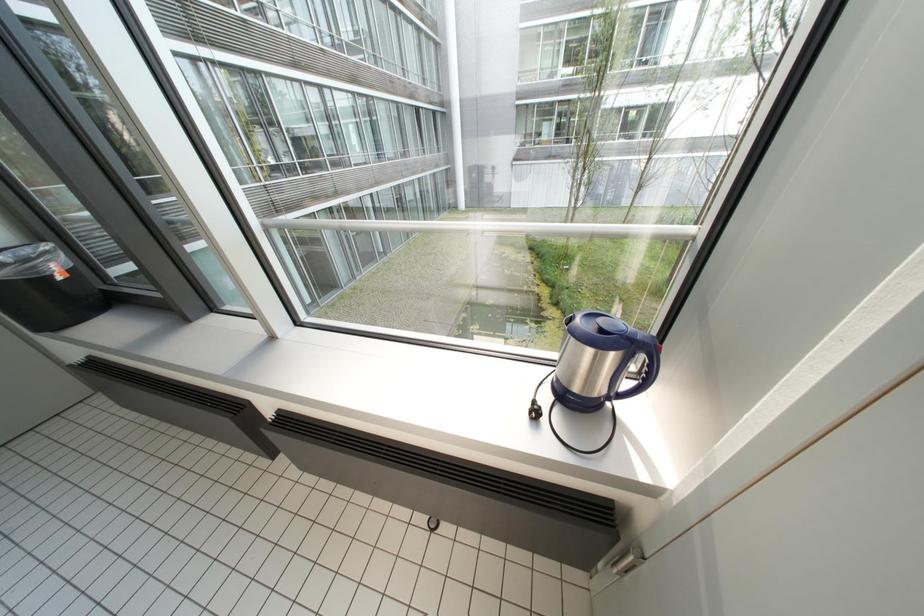
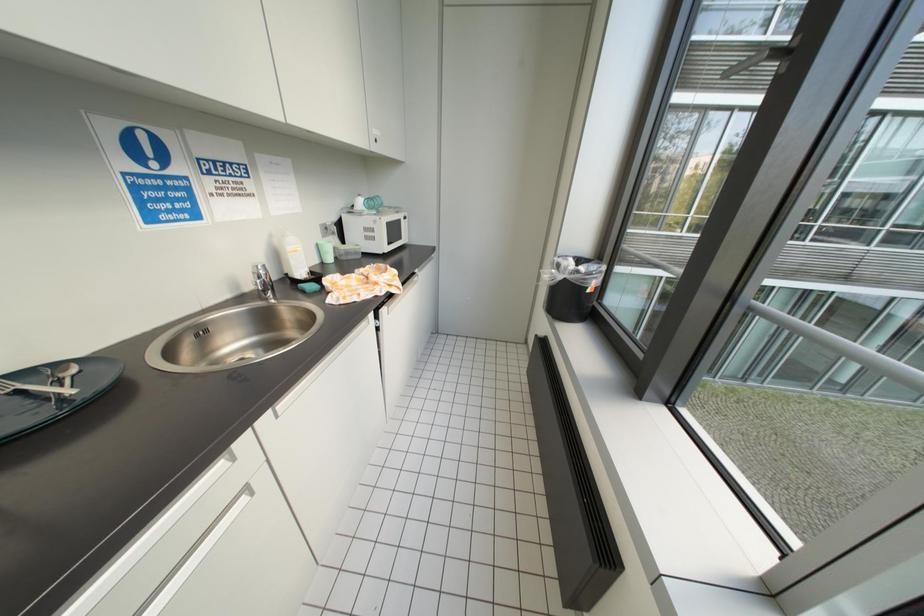
First-person continuous shooting, in which direction is the camera rotating?

The camera's rotation is toward left-down.